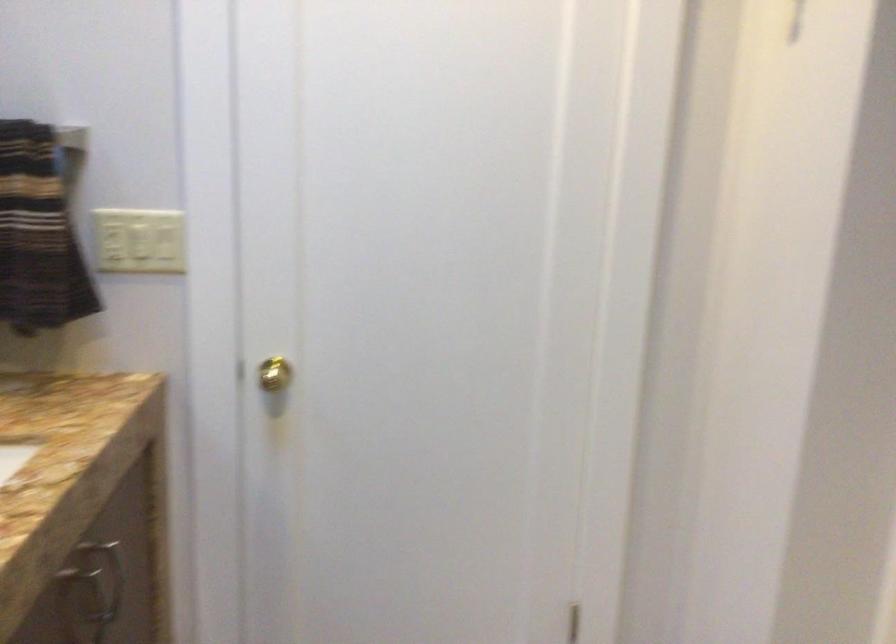
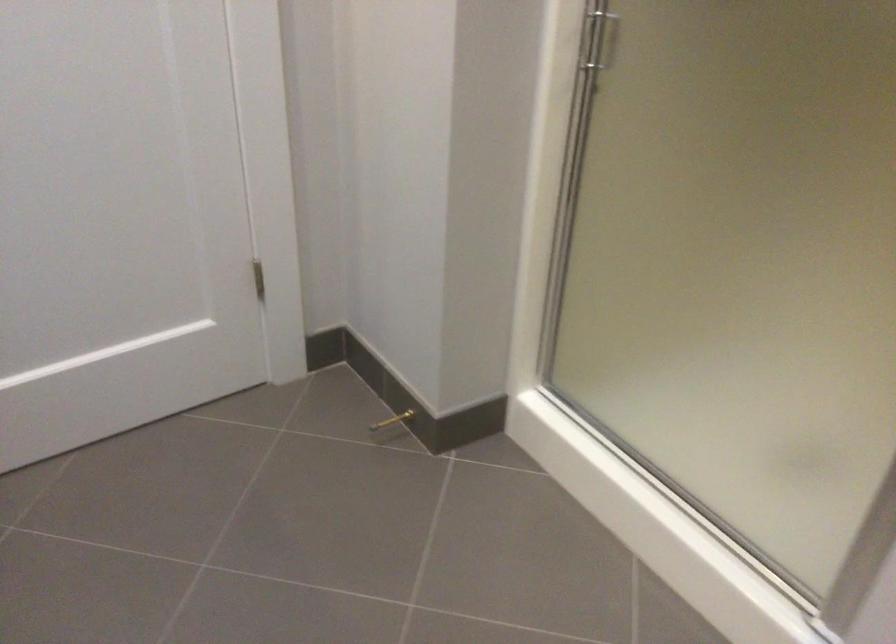
How did the camera likely rotate?

The camera rotated toward right-down.